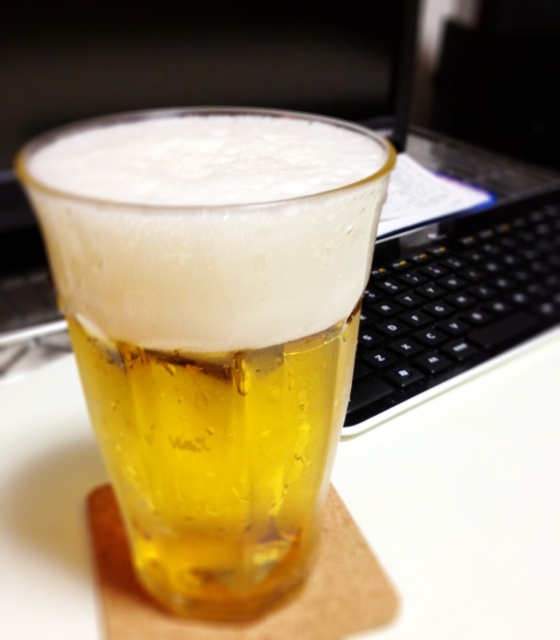
Is the position of translucent glass at center less distant than that of black plastic keyboard at right?

Yes.

What do you see at coordinates (212, 328) in the screenshot? I see `translucent glass at center` at bounding box center [212, 328].

This screenshot has height=640, width=560. What are the coordinates of `translucent glass at center` in the screenshot? It's located at (212, 328).

Where is `translucent glass at center`? translucent glass at center is located at coordinates (212, 328).